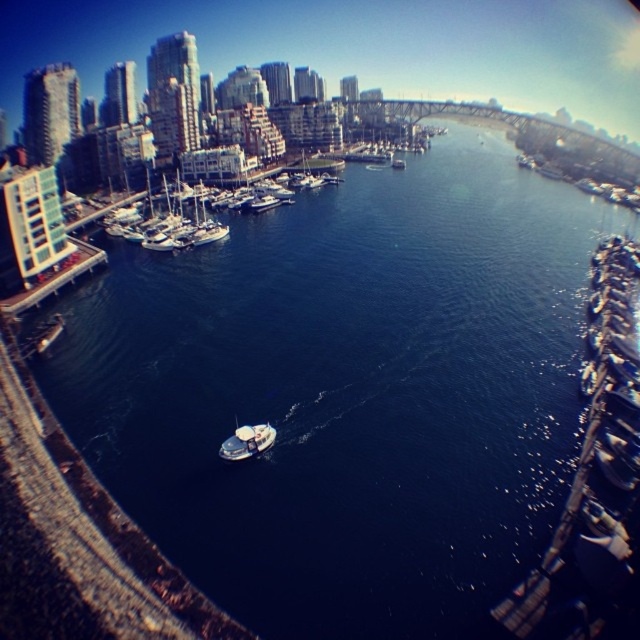
You are a photographer planning to capture a wide shot of the waterfront scene. You notice the white matte boats at center and the smooth concrete dock at left. Based on their positions, which object will appear larger in your photo?

The white matte boats at center will appear larger in the photo because they are taller than the smooth concrete dock at left.

You are standing on the bridge overlooking the waterfront. You see the white matte boats at center. Can you estimate their 2D coordinates in the image?

The 2D coordinates of the white matte boats at center are at point (264, 182).